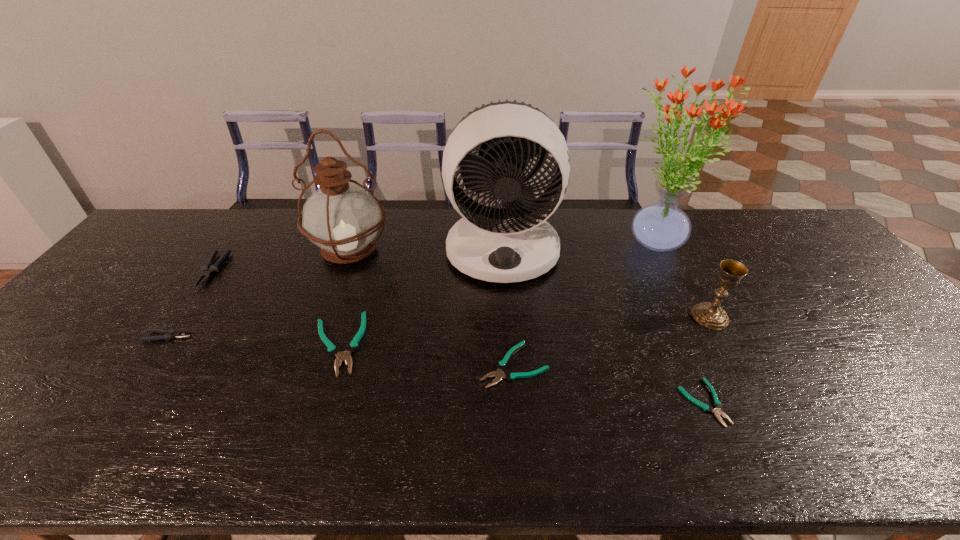
Where is `object that ranks as the eighth closest to the oil lamp`? The image size is (960, 540). object that ranks as the eighth closest to the oil lamp is located at coordinates (711, 315).

Where is `pliers that is the third nearest to the leftmost teal pliers`? Image resolution: width=960 pixels, height=540 pixels. pliers that is the third nearest to the leftmost teal pliers is located at coordinates (208, 268).

Identify the location of pliers identified as the second closest to the smallest teal pliers. This screenshot has width=960, height=540. (333, 349).

Where is `the second closest teal pliers relative to the second smallest teal pliers`? the second closest teal pliers relative to the second smallest teal pliers is located at coordinates (333, 349).

You are a GUI agent. You are given a task and a screenshot of the screen. Output one action in this format:
    pyautogui.click(x=<x>, y=<y>)
    Task: Click on the teal pliers that is the closest one to the nearer gray pliers
    The image size is (960, 540).
    Given the screenshot: What is the action you would take?
    pyautogui.click(x=333, y=349)

The height and width of the screenshot is (540, 960). Find the location of `blank space that satisfies the following two spatial constraints: 1. at the gripping part of the nearer gray pliers; 2. on the left side of the third pliers from right to left`. blank space that satisfies the following two spatial constraints: 1. at the gripping part of the nearer gray pliers; 2. on the left side of the third pliers from right to left is located at coordinates (163, 344).

The image size is (960, 540). Find the location of `vacant region that satisfies the following two spatial constraints: 1. on the back side of the smallest teal pliers; 2. at the gripping part of the nearer gray pliers`. vacant region that satisfies the following two spatial constraints: 1. on the back side of the smallest teal pliers; 2. at the gripping part of the nearer gray pliers is located at coordinates (674, 336).

Identify the location of free space that satisfies the following two spatial constraints: 1. at the gripping part of the biggest teal pliers; 2. on the right side of the fifth shortest object. This screenshot has height=540, width=960. (159, 344).

Locate an element on the screen. free spot that satisfies the following two spatial constraints: 1. on the back side of the leftmost teal pliers; 2. at the gripping part of the smaller gray pliers is located at coordinates (339, 336).

This screenshot has width=960, height=540. What are the coordinates of `free location that satisfies the following two spatial constraints: 1. on the back side of the shortest object; 2. on the left side of the flower arrangement` in the screenshot? It's located at (633, 241).